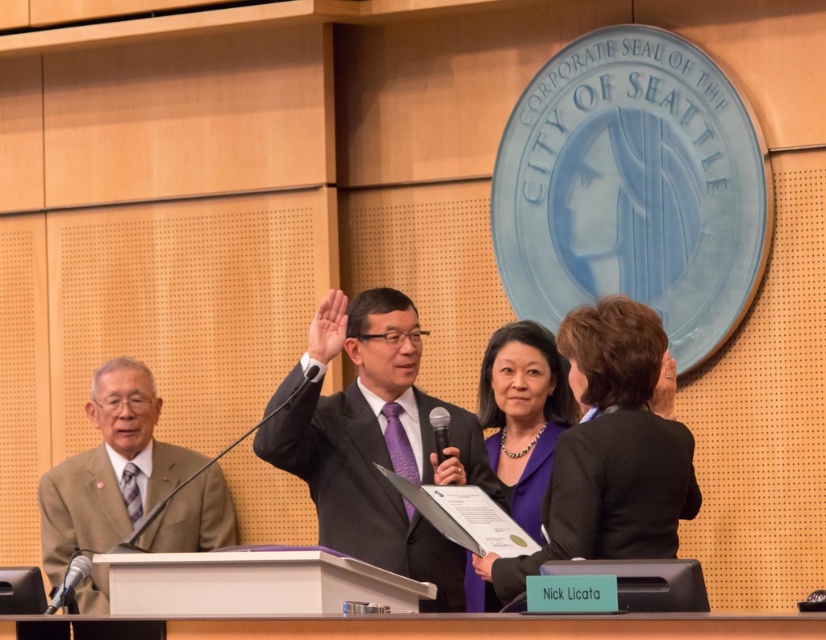
Does matte black suit at center lie behind black metallic microphone at lower left?

Yes.

Between matte black suit at center and black metallic microphone at lower left, which one appears on the left side from the viewer's perspective?

Positioned to the left is black metallic microphone at lower left.

Which is behind, point (331, 545) or point (76, 561)?

The point (331, 545) is behind.

Locate an element on the screen. matte black suit at center is located at coordinates (373, 442).

Based on the photo, is matte black suit at center below purple fabric at center?

No.

Can you confirm if matte black suit at center is positioned above purple fabric at center?

Yes, matte black suit at center is above purple fabric at center.

Between point (401, 304) and point (525, 522), which one is positioned behind?

The point (525, 522) is behind.

In order to click on matte black suit at center in this screenshot , I will do `click(373, 442)`.

Is purple fabric at center bigger than matte black microphone at center?

Yes.

Describe the element at coordinates (523, 413) in the screenshot. I see `purple fabric at center` at that location.

I want to click on purple fabric at center, so click(x=523, y=413).